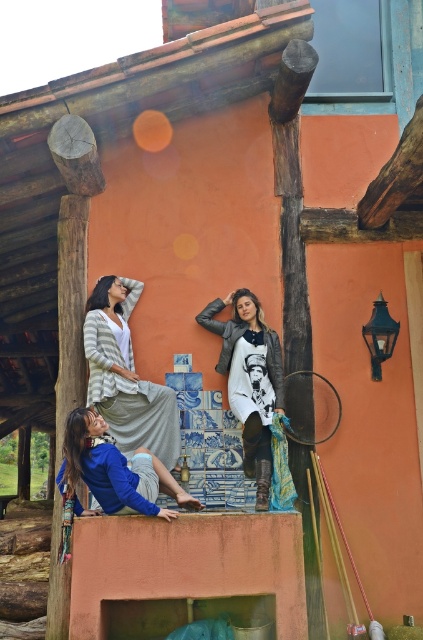
Question: Which point is closer to the camera?

Choices:
 (A) [246, 298]
 (B) [153, 385]

Answer: (B)

Question: Among these objects, which one is farthest from the camera?

Choices:
 (A) striped knit cardigan at upper center
 (B) blue cotton shirt at lower left
 (C) leather jacket at center

Answer: (A)

Question: Observing the image, what is the correct spatial positioning of leather jacket at center in reference to blue cotton shirt at lower left?

Choices:
 (A) below
 (B) above

Answer: (B)

Question: Can you confirm if striped knit cardigan at upper center is positioned above blue cotton shirt at lower left?

Choices:
 (A) no
 (B) yes

Answer: (B)

Question: Among these objects, which one is nearest to the camera?

Choices:
 (A) blue cotton shirt at lower left
 (B) striped knit cardigan at upper center
 (C) leather jacket at center

Answer: (A)

Question: Is striped knit cardigan at upper center smaller than leather jacket at center?

Choices:
 (A) yes
 (B) no

Answer: (A)